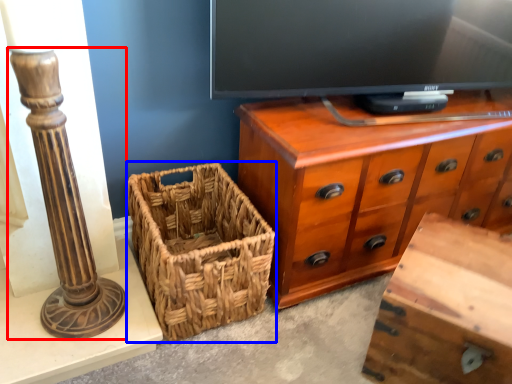
Question: Which point is closer to the camera, pillar (highlighted by a red box) or picnic basket (highlighted by a blue box)?

Choices:
 (A) pillar
 (B) picnic basket

Answer: (A)